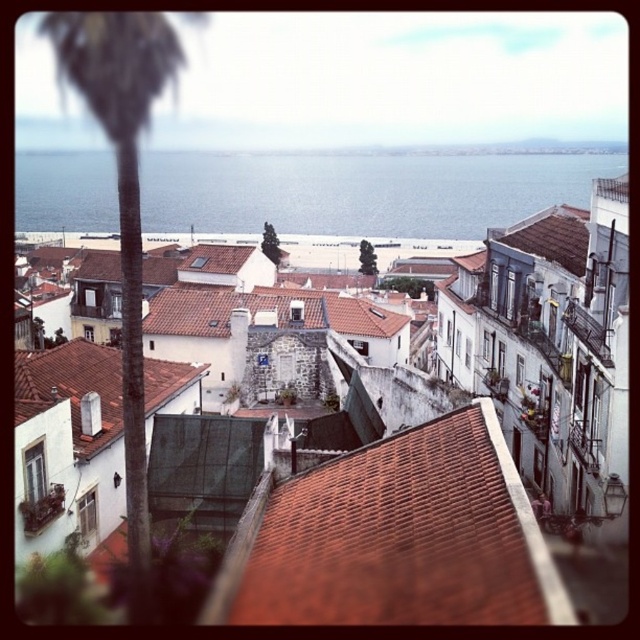
Can you confirm if brown tile roof at center is smaller than brown tile roof at upper right?

Actually, brown tile roof at center might be larger than brown tile roof at upper right.

Is brown tile roof at center shorter than brown tile roof at upper right?

In fact, brown tile roof at center may be taller than brown tile roof at upper right.

Is point (451, 461) positioned after point (538, 256)?

No, it is in front of (538, 256).

What are the coordinates of `brown tile roof at center` in the screenshot? It's located at (396, 538).

What do you see at coordinates (396, 538) in the screenshot? I see `brown tile roof at center` at bounding box center [396, 538].

Is point (333, 561) closer to camera compared to point (333, 170)?

Yes, point (333, 561) is in front of point (333, 170).

Which is in front, point (422, 456) or point (360, 208)?

Point (422, 456)

The image size is (640, 640). I want to click on brown tile roof at center, so click(396, 538).

In the scene shown: Can you confirm if brown tiled roof at center is bigger than brown tile roof at upper right?

Indeed, brown tiled roof at center has a larger size compared to brown tile roof at upper right.

Which is more to the right, brown tiled roof at center or brown tile roof at upper right?

From the viewer's perspective, brown tile roof at upper right appears more on the right side.

Is point (378, 413) closer to viewer compared to point (579, 230)?

That is False.

The width and height of the screenshot is (640, 640). I want to click on brown tiled roof at center, so click(547, 387).